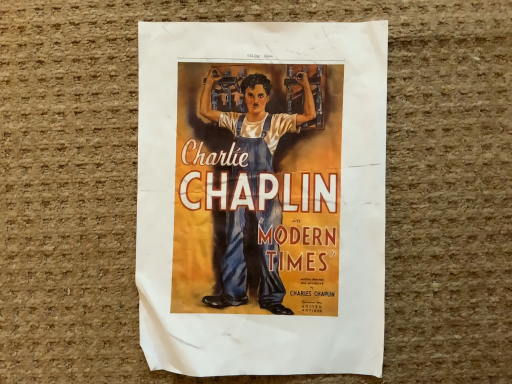
You are a GUI agent. You are given a task and a screenshot of the screen. Output one action in this format:
    pyautogui.click(x=<x>, y=<y>)
    Task: Click on the vacant space situated above matte paper poster at center (from a real-world perspective)
    This screenshot has height=384, width=512.
    Given the screenshot: What is the action you would take?
    pyautogui.click(x=273, y=200)